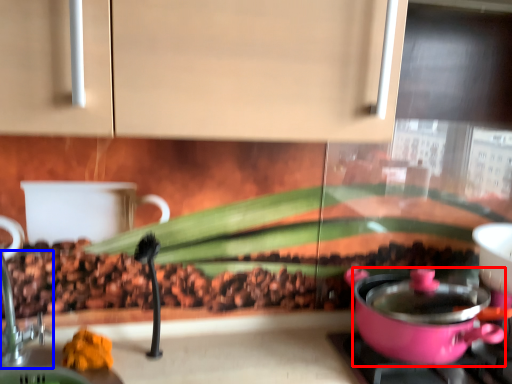
Question: Which of the following is the closest to the observer, kitchen appliance (highlighted by a red box) or faucet (highlighted by a blue box)?

Choices:
 (A) kitchen appliance
 (B) faucet

Answer: (B)